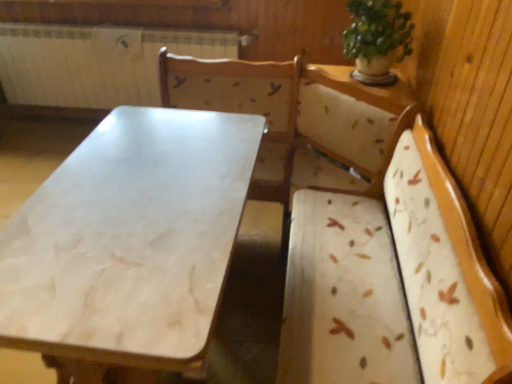
Where is `white painted metal radiator at upper left`? This screenshot has width=512, height=384. white painted metal radiator at upper left is located at coordinates (96, 62).

You are a GUI agent. You are given a task and a screenshot of the screen. Output one action in this format:
    pyautogui.click(x=<x>, y=<y>)
    Task: Click on the white marble table at center
    This screenshot has width=512, height=384.
    Given the screenshot: What is the action you would take?
    pyautogui.click(x=129, y=240)

Could white marble table at center be considered to be inside green leafy plant at upper right?

No, white marble table at center is not surrounded by green leafy plant at upper right.

Based on the photo, between green leafy plant at upper right and white marble table at center, which one has larger size?

white marble table at center is bigger.

Looking at this image, is green leafy plant at upper right not near white marble table at center?

They are positioned close to each other.

Is green leafy plant at upper right positioned before white marble table at center?

No, it is behind white marble table at center.

Is white painted metal radiator at upper left oriented towards white marble table at center?

Yes, white painted metal radiator at upper left is facing white marble table at center.

Which object is wider, white painted metal radiator at upper left or white marble table at center?

With larger width is white marble table at center.

From the image's perspective, is white painted metal radiator at upper left located beneath white marble table at center?

No.

From the picture: Considering the relative positions of white painted metal radiator at upper left and white marble table at center in the image provided, is white painted metal radiator at upper left to the left or to the right of white marble table at center?

Based on their positions, white painted metal radiator at upper left is located to the left of white marble table at center.

From a real-world perspective, which is physically below, white marble table at center or white painted metal radiator at upper left?

white marble table at center is physically lower.

Between white marble table at center and white painted metal radiator at upper left, which one has larger size?

white marble table at center is bigger.

From their relative heights in the image, would you say white marble table at center is taller or shorter than white painted metal radiator at upper left?

Clearly, white marble table at center is taller compared to white painted metal radiator at upper left.

Which point is more forward, (146,346) or (103,36)?

The point (146,346) is in front.

Is white painted metal radiator at upper left facing towards green leafy plant at upper right?

No, white painted metal radiator at upper left is not facing towards green leafy plant at upper right.

Considering the relative sizes of white painted metal radiator at upper left and green leafy plant at upper right in the image provided, is white painted metal radiator at upper left thinner than green leafy plant at upper right?

Indeed, white painted metal radiator at upper left has a lesser width compared to green leafy plant at upper right.

Would you say white painted metal radiator at upper left is a long distance from green leafy plant at upper right?

Yes, white painted metal radiator at upper left and green leafy plant at upper right are quite far apart.

Identify the location of houseplant that is below the white painted metal radiator at upper left (from the image's perspective). Image resolution: width=512 pixels, height=384 pixels. (377, 37).

Is green leafy plant at upper right positioned with its back to white painted metal radiator at upper left?

green leafy plant at upper right does not have its back to white painted metal radiator at upper left.

Considering the positions of objects green leafy plant at upper right and white painted metal radiator at upper left in the image provided, who is in front, green leafy plant at upper right or white painted metal radiator at upper left?

green leafy plant at upper right is more forward.

Is green leafy plant at upper right thinner than white painted metal radiator at upper left?

In fact, green leafy plant at upper right might be wider than white painted metal radiator at upper left.

Is white marble table at center wider than green leafy plant at upper right?

Yes.

Is white marble table at center positioned far away from green leafy plant at upper right?

No, white marble table at center is not far from green leafy plant at upper right.

Identify the location of table on the left of the green leafy plant at upper right. The width and height of the screenshot is (512, 384). (129, 240).

Who is smaller, white marble table at center or green leafy plant at upper right?

Smaller between the two is green leafy plant at upper right.

The height and width of the screenshot is (384, 512). Identify the location of houseplant on the right of the white marble table at center. (377, 37).

The image size is (512, 384). Identify the location of radiator that is above the white marble table at center (from a real-world perspective). (96, 62).

Which object lies nearer to the anchor point white painted metal radiator at upper left, white marble table at center or green leafy plant at upper right?

green leafy plant at upper right lies closer to white painted metal radiator at upper left than the other object.

In the scene shown: Estimate the real-world distances between objects in this image. Which object is further from white marble table at center, white painted metal radiator at upper left or green leafy plant at upper right?

white painted metal radiator at upper left.

From the image, which object appears to be farther from white painted metal radiator at upper left, green leafy plant at upper right or white marble table at center?

Among the two, white marble table at center is located further to white painted metal radiator at upper left.

Estimate the real-world distances between objects in this image. Which object is closer to green leafy plant at upper right, white marble table at center or white painted metal radiator at upper left?

white marble table at center lies closer to green leafy plant at upper right than the other object.

Estimate the real-world distances between objects in this image. Which object is further from green leafy plant at upper right, white painted metal radiator at upper left or white marble table at center?

white painted metal radiator at upper left.

When comparing their distances from white marble table at center, does green leafy plant at upper right or white painted metal radiator at upper left seem further?

The object further to white marble table at center is white painted metal radiator at upper left.

This screenshot has width=512, height=384. I want to click on houseplant between white marble table at center and white painted metal radiator at upper left along the z-axis, so click(x=377, y=37).